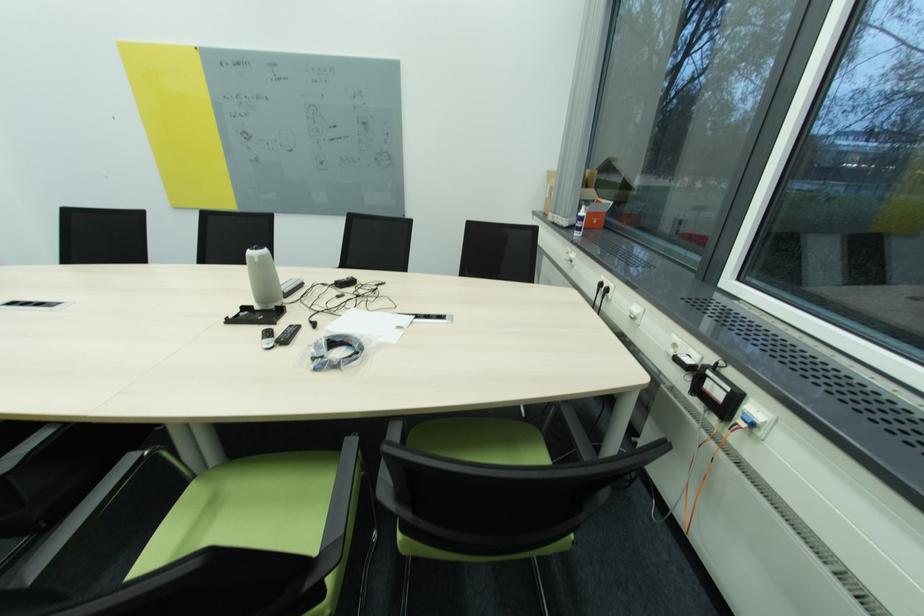
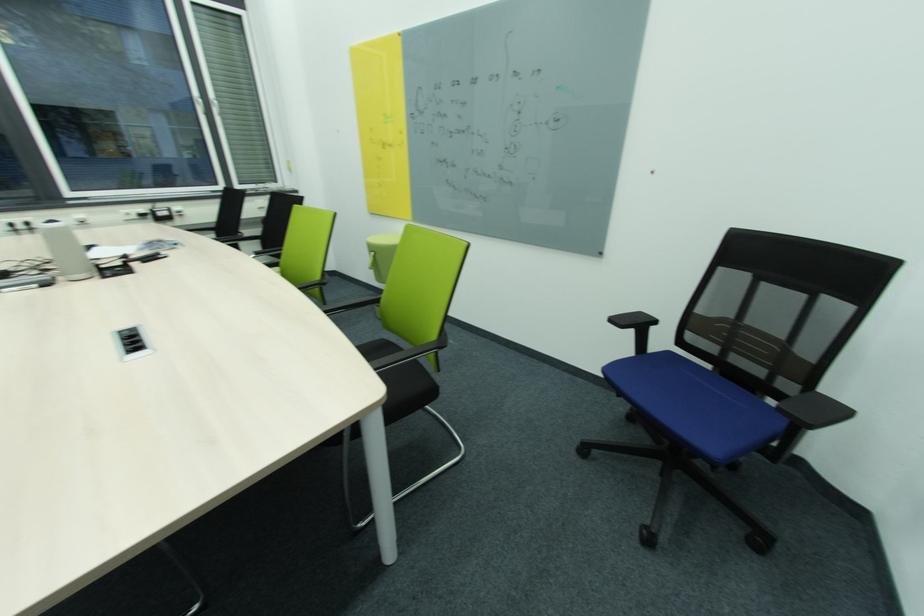
Where in the second image is the point corresponding to (x=57, y=304) from the first image?

(126, 338)